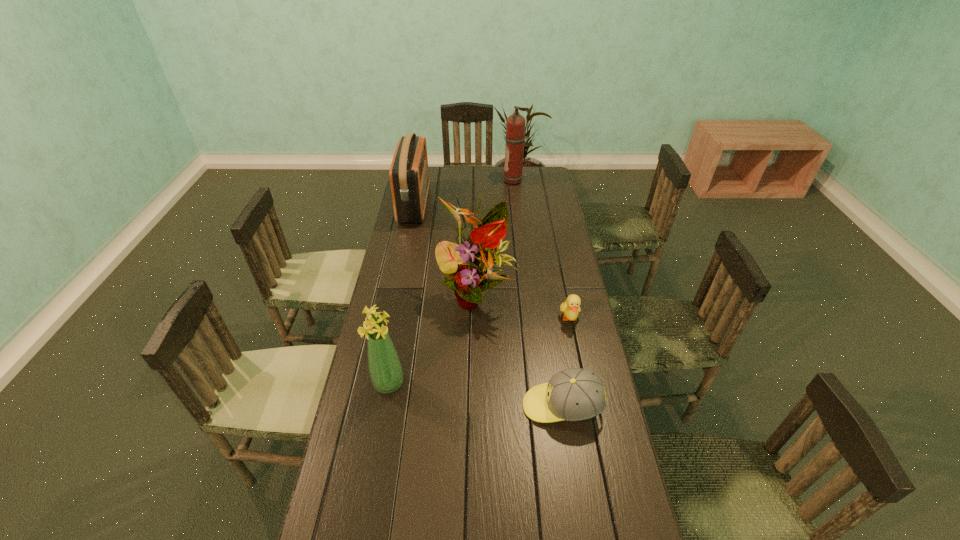
The height and width of the screenshot is (540, 960). I want to click on free spot located 0.140m on the front-facing side of the left bouquet, so click(x=449, y=383).

Where is `blank space located on the front-facing side of the radio receiver`? This screenshot has width=960, height=540. blank space located on the front-facing side of the radio receiver is located at coordinates (506, 204).

At what (x,y) coordinates should I click in order to perform the action: click on vacant space located on the front-facing side of the baseball cap. Please return your answer as a coordinate pair (x, y). This screenshot has width=960, height=540. Looking at the image, I should click on (429, 406).

At what (x,y) coordinates should I click in order to perform the action: click on vacant space located 0.130m on the front-facing side of the baseball cap. Please return your answer as a coordinate pair (x, y). Looking at the image, I should click on (479, 406).

Find the location of a particular element. The width and height of the screenshot is (960, 540). vacant area situated on the front-facing side of the baseball cap is located at coordinates (443, 406).

Locate an element on the screen. free space located on the front-facing side of the duckling is located at coordinates (578, 357).

The width and height of the screenshot is (960, 540). Find the location of `fire extinguisher present at the far edge`. fire extinguisher present at the far edge is located at coordinates (515, 125).

You are a GUI agent. You are given a task and a screenshot of the screen. Output one action in this format:
    pyautogui.click(x=<x>, y=<y>)
    Task: Click on the radio receiver that is at the far edge
    
    Given the screenshot: What is the action you would take?
    pyautogui.click(x=409, y=174)

Where is `bouquet that is at the left edge`? This screenshot has width=960, height=540. bouquet that is at the left edge is located at coordinates (385, 369).

Find the location of `radio receiver that is positioned at the left edge`. radio receiver that is positioned at the left edge is located at coordinates (409, 174).